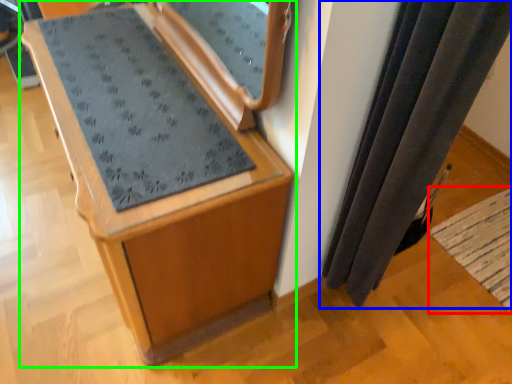
Question: Which object is the farthest from mat (highlighted by a red box)? Choose among these: curtain (highlighted by a blue box) or furniture (highlighted by a green box).

Choices:
 (A) curtain
 (B) furniture

Answer: (B)